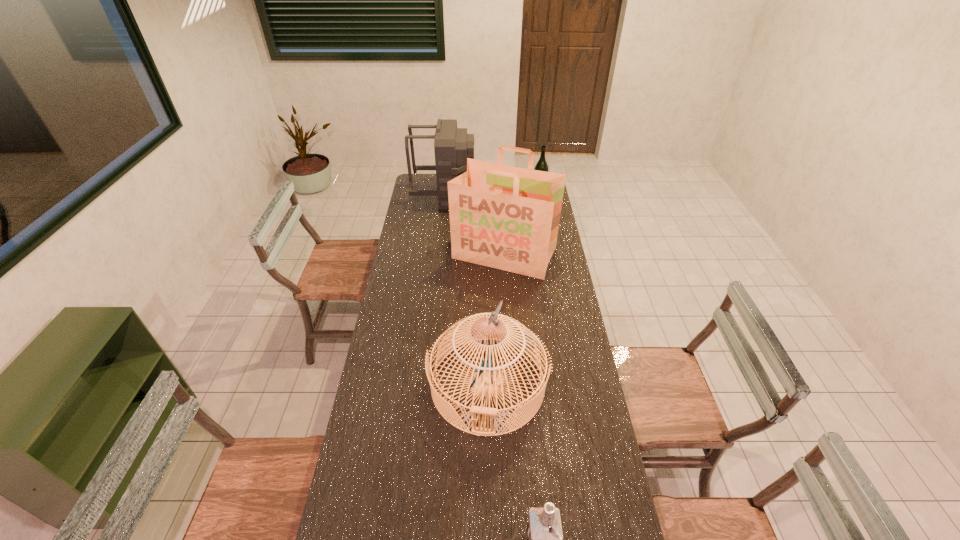
In order to click on grocery bag in this screenshot , I will do `click(504, 217)`.

Image resolution: width=960 pixels, height=540 pixels. Find the location of `the third farthest object`. the third farthest object is located at coordinates (504, 217).

At what (x,y) coordinates should I click in order to perform the action: click on backpack. Please return your answer as a coordinate pair (x, y). The image size is (960, 540). Looking at the image, I should click on (452, 146).

Find the location of a particular element. This screenshot has height=540, width=960. birdcage is located at coordinates (488, 383).

In order to click on the fourth tallest object in this screenshot , I will do `click(541, 165)`.

Where is `free space located on the back of the tallest object`? The height and width of the screenshot is (540, 960). free space located on the back of the tallest object is located at coordinates (500, 197).

The height and width of the screenshot is (540, 960). What are the coordinates of `vacant space situated on the front compartment of the backpack` in the screenshot? It's located at (525, 195).

You are a GUI agent. You are given a task and a screenshot of the screen. Output one action in this format:
    pyautogui.click(x=<x>, y=<y>)
    Task: Click on the blank area located on the back of the birdcage
    The width and height of the screenshot is (960, 540).
    Given the screenshot: What is the action you would take?
    pyautogui.click(x=487, y=290)

At what (x,y) coordinates should I click in order to perform the action: click on vacant region located on the surface of the fourth tallest object. Please return your answer as a coordinate pair (x, y). Looking at the image, I should click on (542, 211).

The image size is (960, 540). In order to click on backpack that is at the far edge in this screenshot , I will do `click(452, 146)`.